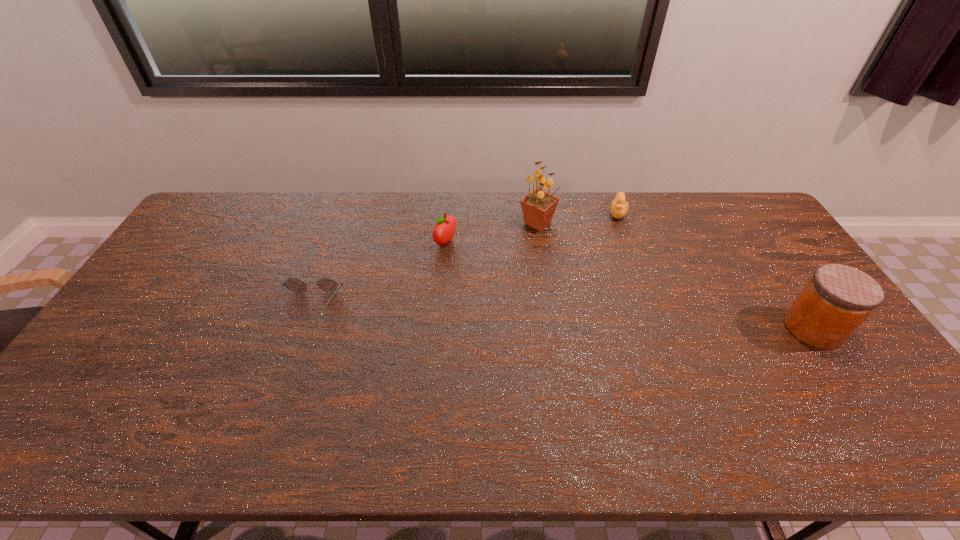
What are the coordinates of `the third closest object to the apple` in the screenshot? It's located at (619, 207).

In order to click on vacant space that satisfies the following two spatial constraints: 1. on the back side of the second object from left to right; 2. on the right side of the third object from left to right in this screenshot , I will do `click(447, 223)`.

Image resolution: width=960 pixels, height=540 pixels. I want to click on free space that satisfies the following two spatial constraints: 1. on the back side of the apple; 2. on the left side of the sunflower, so click(x=447, y=223).

The width and height of the screenshot is (960, 540). I want to click on free space that satisfies the following two spatial constraints: 1. on the back side of the second object from right to left; 2. on the right side of the sunflower, so click(x=536, y=213).